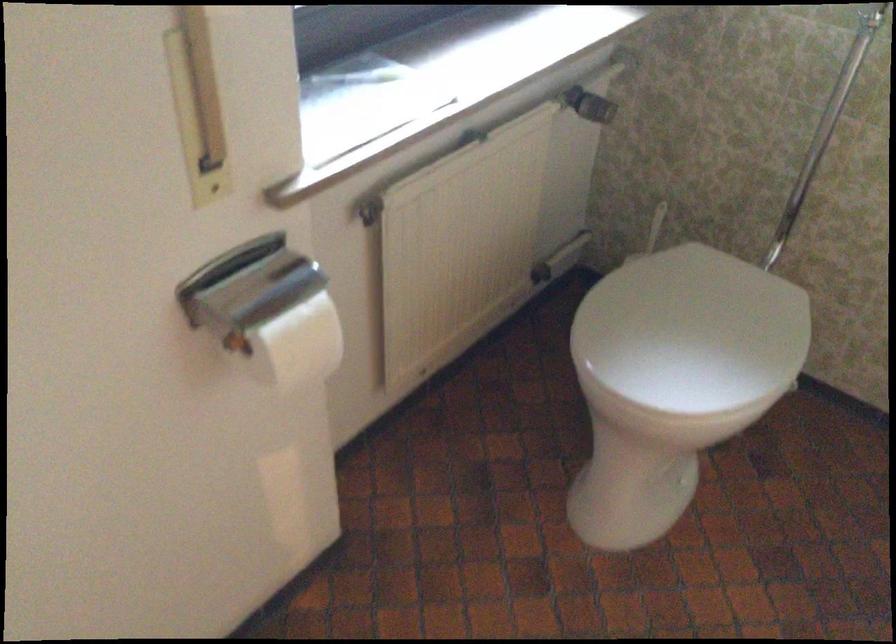
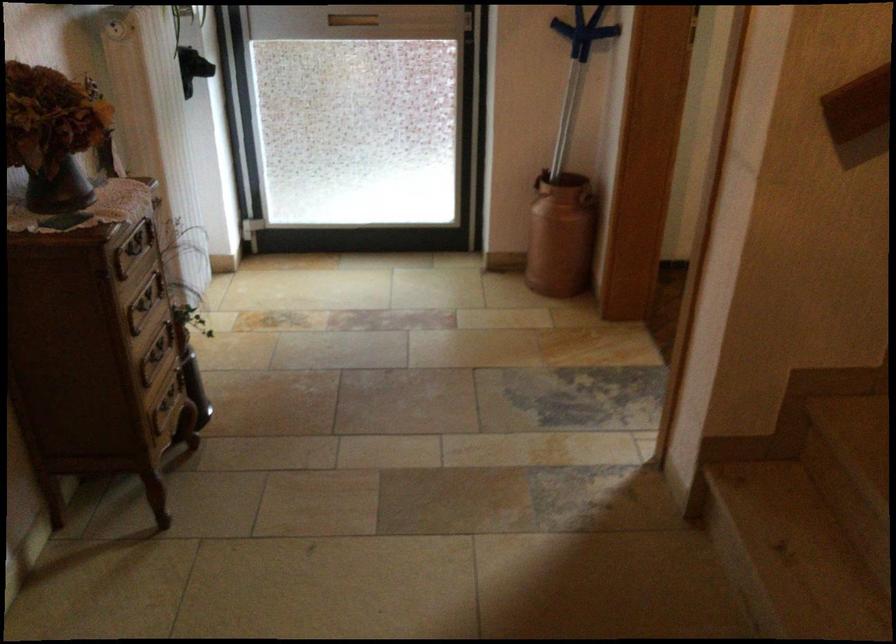
Question: I am providing you with two images of the same scene from different viewpoints. Which of the following objects are not visible in image2?

Choices:
 (A) mail slot
 (B) conference speakerphone
 (C) toilet paper cover
 (D) drawer handle

Answer: (C)